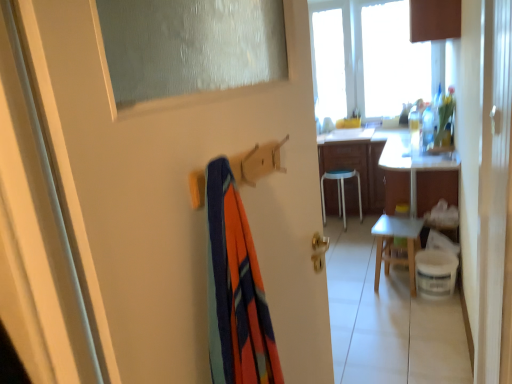
Question: From the image's perspective, does wooden chair at center appear lower than white glossy desk at right?

Choices:
 (A) no
 (B) yes

Answer: (B)

Question: Does wooden chair at center come behind white glossy desk at right?

Choices:
 (A) yes
 (B) no

Answer: (B)

Question: Is wooden chair at center at the left side of white glossy desk at right?

Choices:
 (A) yes
 (B) no

Answer: (A)

Question: Is white glossy desk at right inside wooden chair at center?

Choices:
 (A) no
 (B) yes

Answer: (A)

Question: Does wooden chair at center appear on the right side of white glossy desk at right?

Choices:
 (A) no
 (B) yes

Answer: (A)

Question: Is wooden chair at center positioned far away from white glossy desk at right?

Choices:
 (A) yes
 (B) no

Answer: (B)

Question: Is white glossy desk at right turned away from wooden chair at center?

Choices:
 (A) no
 (B) yes

Answer: (A)

Question: Would you say wooden chair at center is part of white glossy desk at right's contents?

Choices:
 (A) yes
 (B) no

Answer: (B)

Question: From the image's perspective, is white glossy desk at right above wooden chair at center?

Choices:
 (A) yes
 (B) no

Answer: (A)

Question: Does white glossy desk at right have a greater height compared to wooden chair at center?

Choices:
 (A) yes
 (B) no

Answer: (A)

Question: Would you say white glossy desk at right is a long distance from wooden chair at center?

Choices:
 (A) yes
 (B) no

Answer: (B)

Question: Is white glossy desk at right to the right of wooden chair at center from the viewer's perspective?

Choices:
 (A) no
 (B) yes

Answer: (B)

Question: Considering the positions of white glossy desk at right and wooden chair at center in the image, is white glossy desk at right taller or shorter than wooden chair at center?

Choices:
 (A) short
 (B) tall

Answer: (B)